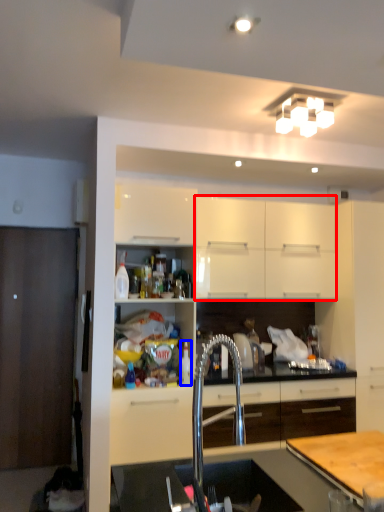
Question: Which of the following is the farthest to the observer, cabinetry (highlighted by a red box) or bottle (highlighted by a blue box)?

Choices:
 (A) cabinetry
 (B) bottle

Answer: (A)